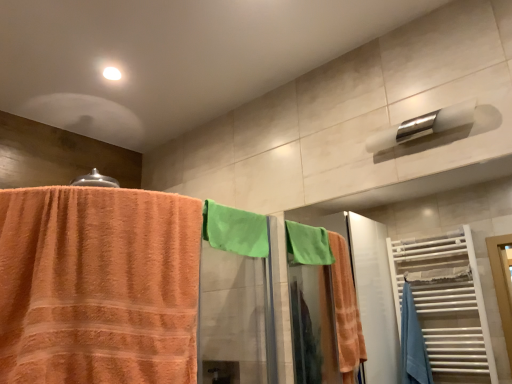
Find the location of a particular element. white glossy towel bar at upper right is located at coordinates (422, 126).

Measure the distance between point (196, 326) and camera.

Point (196, 326) and camera are 4.11 feet apart.

At what (x,y) coordinates should I click in order to perform the action: click on green terry cloth towel at center. Please return your answer as a coordinate pair (x, y). The image size is (512, 384). Looking at the image, I should click on (234, 230).

Can you tell me how much green terry cloth towel at center and orange terry cloth towel at left differ in facing direction?

The angular difference between green terry cloth towel at center and orange terry cloth towel at left is 27.3 degrees.

Considering the relative positions of green terry cloth towel at center and orange terry cloth towel at left in the image provided, is green terry cloth towel at center to the left or to the right of orange terry cloth towel at left?

green terry cloth towel at center is to the right of orange terry cloth towel at left.

Can you confirm if green terry cloth towel at center is shorter than orange terry cloth towel at left?

Yes, green terry cloth towel at center is shorter than orange terry cloth towel at left.

The height and width of the screenshot is (384, 512). Find the location of `beach towel positioned vertically above the orange terry cloth towel at left (from a real-world perspective)`. beach towel positioned vertically above the orange terry cloth towel at left (from a real-world perspective) is located at coordinates (234, 230).

From a real-world perspective, which is physically above, orange terry cloth towel at left or white glossy towel bar at upper right?

white glossy towel bar at upper right is physically above.

Which is nearer, (197, 246) or (397, 139)?

Point (197, 246) is positioned closer to the camera compared to point (397, 139).

Choose the correct answer: Is orange terry cloth towel at left inside white glossy towel bar at upper right or outside it?

orange terry cloth towel at left is located beyond the bounds of white glossy towel bar at upper right.

Considering the sizes of objects orange terry cloth towel at left and white glossy towel bar at upper right in the image provided, who is bigger, orange terry cloth towel at left or white glossy towel bar at upper right?

orange terry cloth towel at left is bigger.

Locate an element on the screen. The height and width of the screenshot is (384, 512). towel bar above the green terry cloth towel at center (from a real-world perspective) is located at coordinates (422, 126).

Is the position of white glossy towel bar at upper right less distant than that of green terry cloth towel at center?

Yes, the depth of white glossy towel bar at upper right is less than that of green terry cloth towel at center.

Is white glossy towel bar at upper right placed right next to green terry cloth towel at center?

They are not placed beside each other.

Does point (39, 300) appear closer or farther from the camera than point (259, 249)?

Point (39, 300) is positioned closer to the camera compared to point (259, 249).

Does orange terry cloth towel at left have a greater height compared to green terry cloth towel at center?

Correct, orange terry cloth towel at left is much taller as green terry cloth towel at center.

From the image's perspective, would you say orange terry cloth towel at left is shown under green terry cloth towel at center?

Indeed, from the image's perspective, orange terry cloth towel at left is shown beneath green terry cloth towel at center.

Which object is closer to the camera, green terry cloth towel at center or white glossy towel bar at upper right?

white glossy towel bar at upper right is in front.

From the image's perspective, between green terry cloth towel at center and white glossy towel bar at upper right, which one is located above?

white glossy towel bar at upper right appears higher in the image.

Can white glossy towel bar at upper right be found inside green terry cloth towel at center?

That's incorrect, white glossy towel bar at upper right is not inside green terry cloth towel at center.

Is green terry cloth towel at center not near white glossy towel bar at upper right?

No.

Is white glossy towel bar at upper right wider or thinner than orange terry cloth towel at left?

Considering their sizes, white glossy towel bar at upper right looks slimmer than orange terry cloth towel at left.

Is orange terry cloth towel at left surrounded by white glossy towel bar at upper right?

Actually, orange terry cloth towel at left is outside white glossy towel bar at upper right.

From the image's perspective, is white glossy towel bar at upper right located above or below orange terry cloth towel at left?

Based on their image positions, white glossy towel bar at upper right is located above orange terry cloth towel at left.

Identify the location of beach towel above the orange terry cloth towel at left (from the image's perspective). This screenshot has width=512, height=384. (234, 230).

This screenshot has width=512, height=384. What are the coordinates of `towel bar on the right of the orange terry cloth towel at left` in the screenshot? It's located at (422, 126).

When comparing their distances from orange terry cloth towel at left, does green terry cloth towel at center or white glossy towel bar at upper right seem closer?

green terry cloth towel at center is closer to orange terry cloth towel at left.

Which object lies nearer to the anchor point white glossy towel bar at upper right, green terry cloth towel at center or orange terry cloth towel at left?

green terry cloth towel at center is closer to white glossy towel bar at upper right.

From the image, which object appears to be farther from green terry cloth towel at center, white glossy towel bar at upper right or orange terry cloth towel at left?

Among the two, white glossy towel bar at upper right is located further to green terry cloth towel at center.

Estimate the real-world distances between objects in this image. Which object is closer to green terry cloth towel at center, orange terry cloth towel at left or white glossy towel bar at upper right?

orange terry cloth towel at left is positioned closer to the anchor green terry cloth towel at center.

When comparing their distances from orange terry cloth towel at left, does white glossy towel bar at upper right or green terry cloth towel at center seem closer?

green terry cloth towel at center is positioned closer to the anchor orange terry cloth towel at left.

From the image, which object appears to be nearer to white glossy towel bar at upper right, orange terry cloth towel at left or green terry cloth towel at center?

green terry cloth towel at center.

In order to click on beach towel between orange terry cloth towel at left and white glossy towel bar at upper right in this screenshot , I will do `click(234, 230)`.